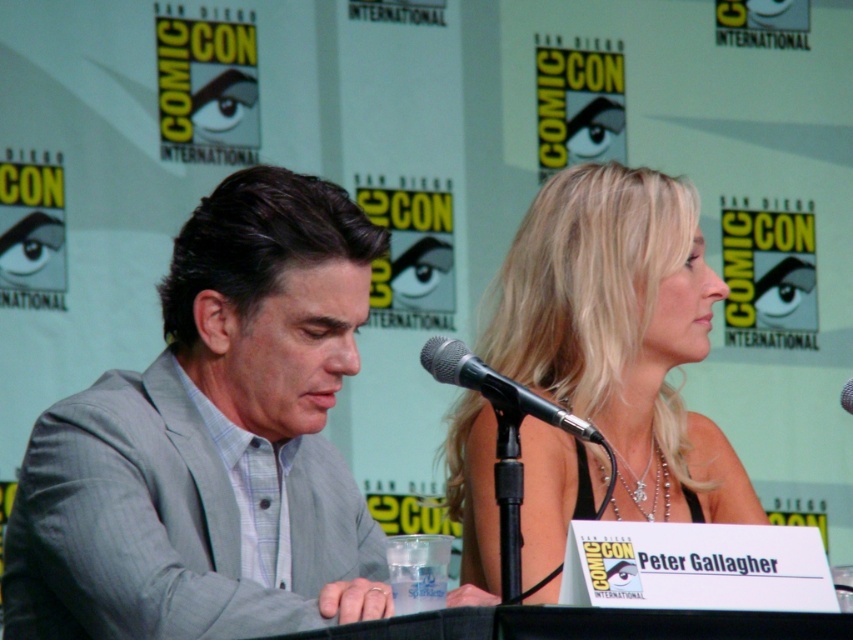
Question: Does gray pinstripe suit at left appear on the left side of blonde hair at center?

Choices:
 (A) no
 (B) yes

Answer: (B)

Question: Which object is positioned closest to the gray pinstripe suit at left?

Choices:
 (A) black metallic microphone at center
 (B) blonde hair at center

Answer: (A)

Question: Can you confirm if gray pinstripe suit at left is wider than black metallic microphone at center?

Choices:
 (A) no
 (B) yes

Answer: (B)

Question: Is gray pinstripe suit at left positioned in front of black metallic microphone at center?

Choices:
 (A) yes
 (B) no

Answer: (A)

Question: Which object appears closest to the camera in this image?

Choices:
 (A) gray pinstripe suit at left
 (B) blonde hair at center
 (C) black metallic microphone at center

Answer: (A)

Question: Which object is the farthest from the gray pinstripe suit at left?

Choices:
 (A) blonde hair at center
 (B) black metallic microphone at center

Answer: (A)